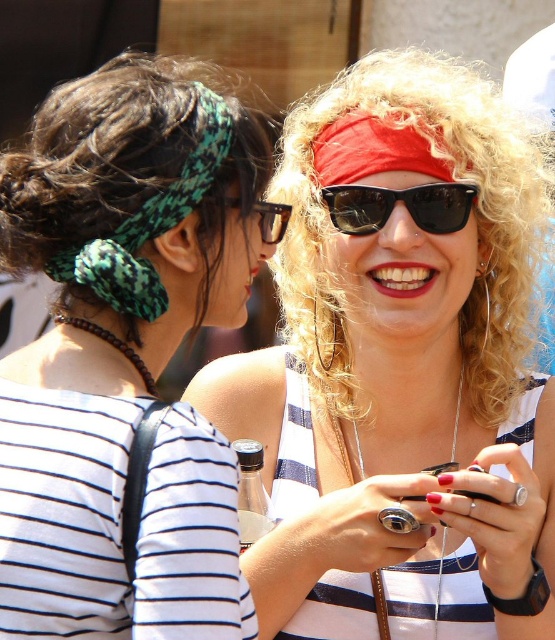
Question: Which point is closer to the camera?

Choices:
 (A) (201, 488)
 (B) (173, 202)

Answer: (A)

Question: Which point is closer to the camera?

Choices:
 (A) green knitted headscarf at upper left
 (B) brown plastic glasses at upper center
 (C) green woven headband at upper left

Answer: (A)

Question: Can you confirm if green woven headband at upper left is positioned above green knitted headscarf at upper left?

Choices:
 (A) yes
 (B) no

Answer: (B)

Question: Where is green woven headband at upper left located in relation to green knitted headscarf at upper left in the image?

Choices:
 (A) left
 (B) right

Answer: (B)

Question: Observing the image, what is the correct spatial positioning of matte red bandana at center in reference to brown plastic glasses at upper center?

Choices:
 (A) right
 (B) left

Answer: (A)

Question: Which object appears farthest from the camera in this image?

Choices:
 (A) black plastic sunglasses at center
 (B) brown plastic glasses at upper center
 (C) green knitted headscarf at upper left

Answer: (A)